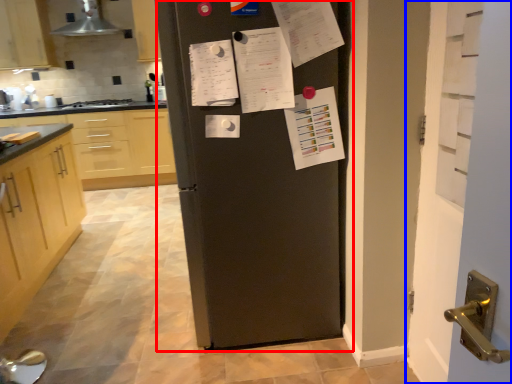
Question: Which point is further to the camera, refrigerator (highlighted by a red box) or door (highlighted by a blue box)?

Choices:
 (A) refrigerator
 (B) door

Answer: (A)